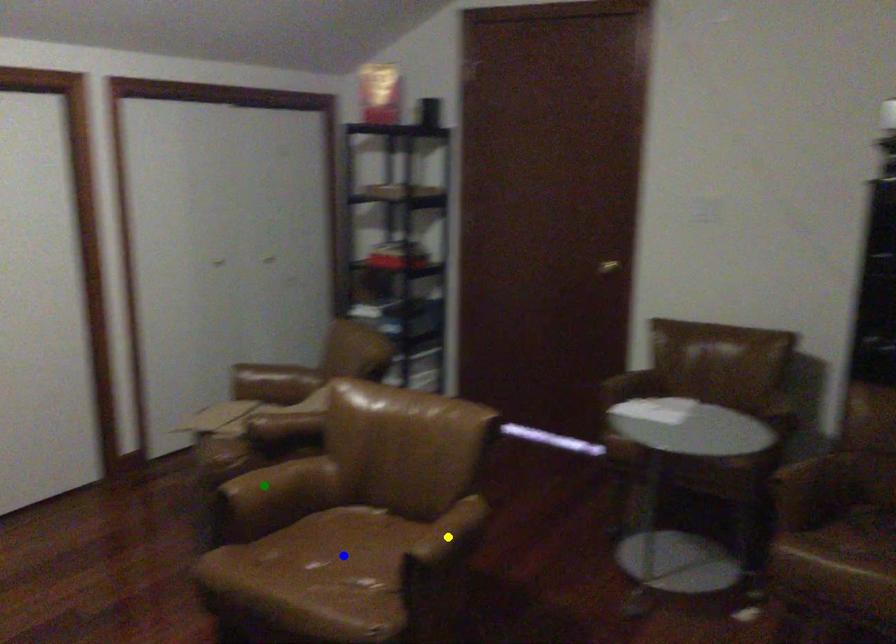
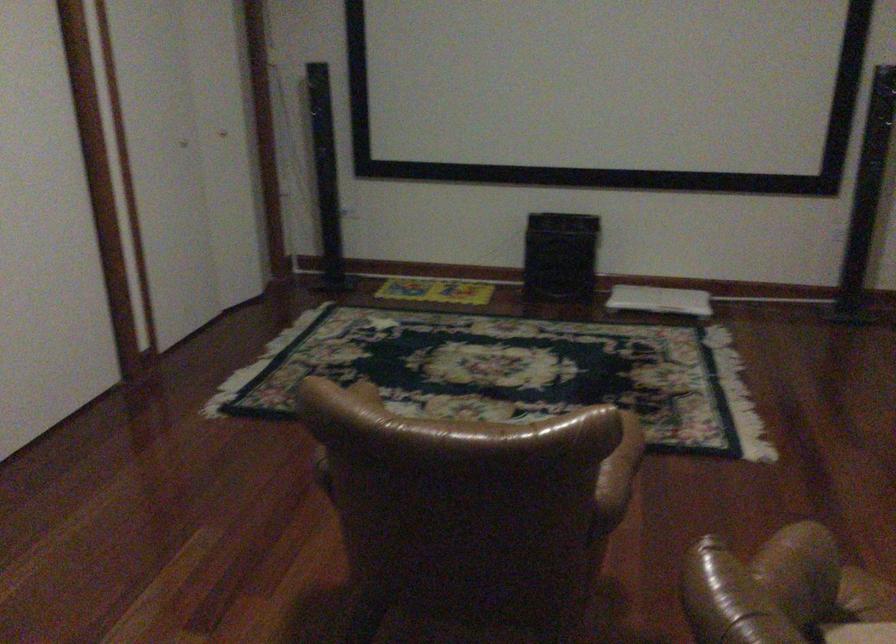
I am providing you with two images of the same scene from different viewpoints. Three points are marked in image1. Which point corresponds to a part or object that is occluded in image2?In image1, three points are marked. Which of them correspond to a part or object that is occluded in image2?Among the three points shown in image1, which one corresponds to a part or object that is no longer visible due to occlusion in image2?

blue point, yellow point cannot be seen in image2.